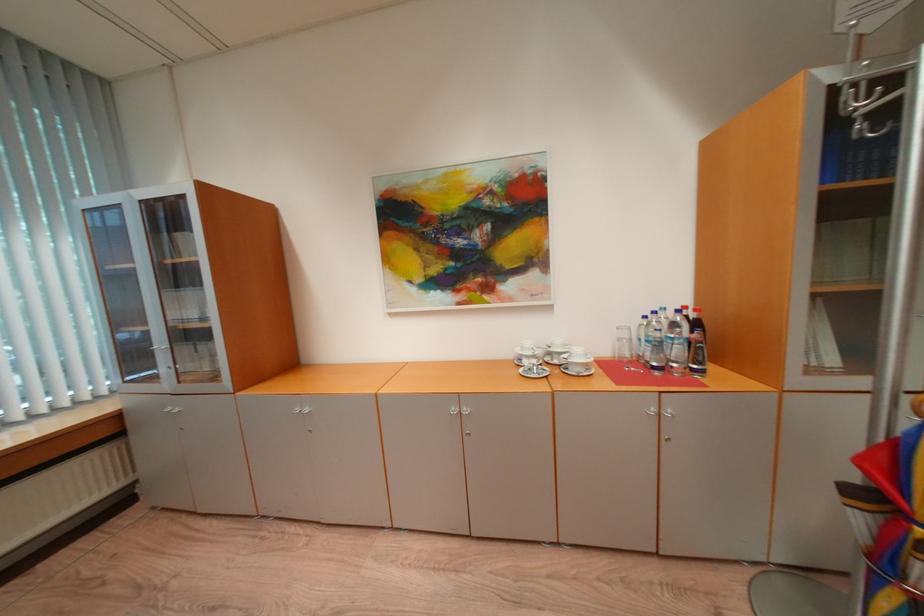
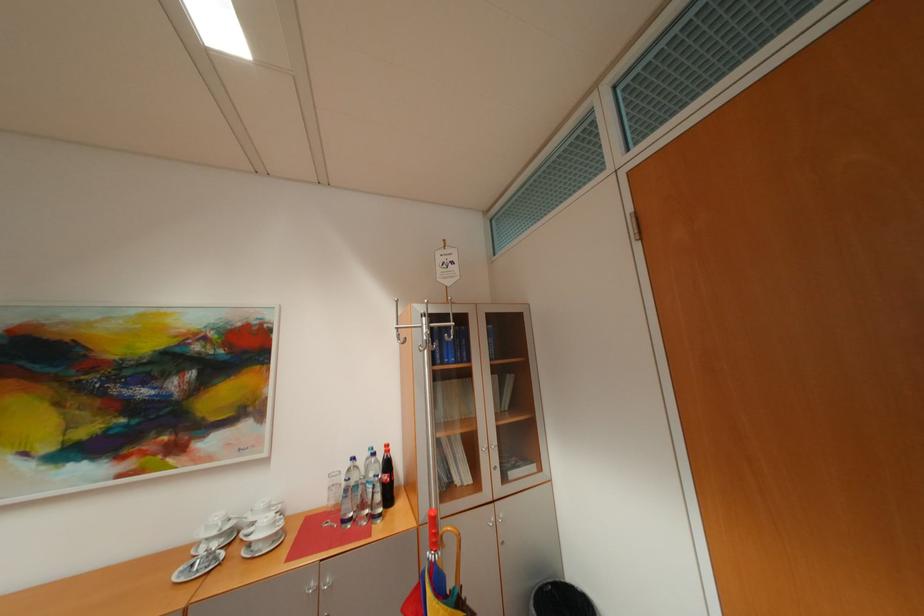
The images are taken continuously from a first-person perspective. In which direction is your viewpoint rotating?

The rotation direction of the camera is right-up.